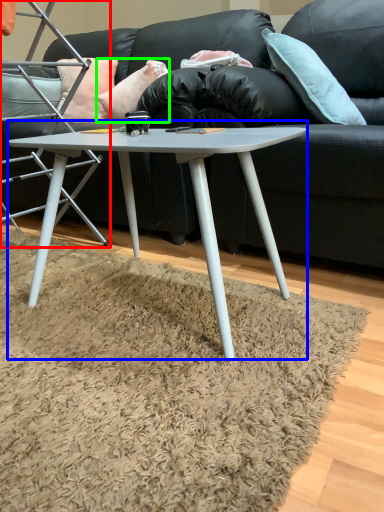
Question: Based on their relative distances, which object is nearer to chair (highlighted by a red box)? Choose from coffee table (highlighted by a blue box) and pillow (highlighted by a green box).

Choices:
 (A) coffee table
 (B) pillow

Answer: (B)